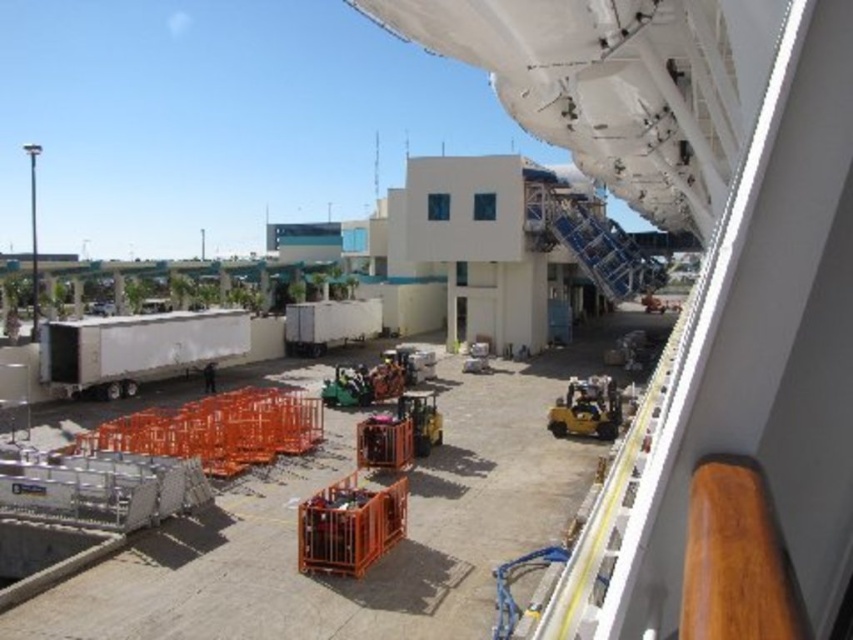
Question: Which of the following is the farthest from the observer?

Choices:
 (A) (364, 317)
 (B) (39, 362)

Answer: (A)

Question: Is white matte trailer truck at center-left smaller than white matte trailer truck at center?

Choices:
 (A) yes
 (B) no

Answer: (B)

Question: Can you confirm if white matte trailer truck at center-left is positioned above white matte trailer truck at center?

Choices:
 (A) yes
 (B) no

Answer: (B)

Question: Considering the relative positions of white matte trailer truck at center-left and white matte trailer truck at center in the image provided, where is white matte trailer truck at center-left located with respect to white matte trailer truck at center?

Choices:
 (A) right
 (B) left

Answer: (B)

Question: Which point appears farthest from the camera in this image?

Choices:
 (A) (120, 348)
 (B) (341, 316)

Answer: (B)